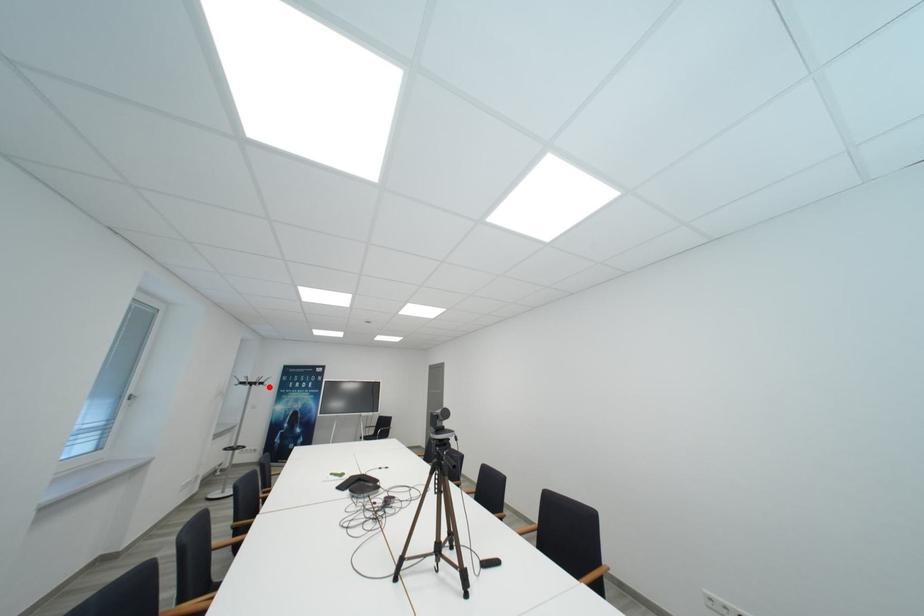
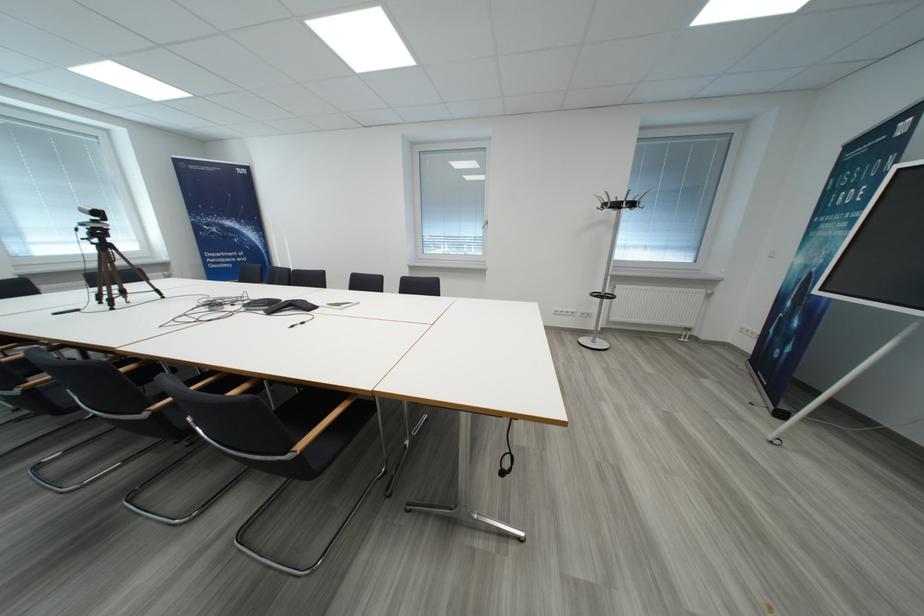
Question: I am providing you with two images of the same scene from different viewpoints. In image1, a red point is highlighted. Considering the same 3D point in image2, which of the following is correct?

Choices:
 (A) It is closer
 (B) It is farther

Answer: (A)